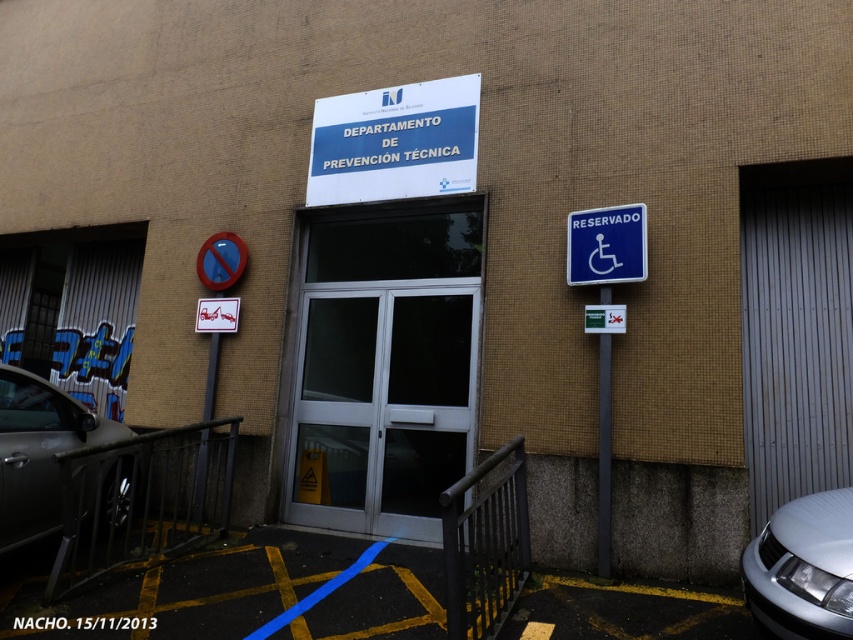
Consider the image. You are a delivery person trying to park your silver metallic car at lower right near the entrance. The white glass door at center is in the way. Can you drive your car past the door without hitting it?

The white glass door at center has a greater height compared to the silver metallic car at lower right. Since the door is taller, it won

You are a visitor arriving at the Department of Technical Prevention building. You see a silver metallic car at lower right and a shiny black car at lower left. Which car is closer to the ground?

The silver metallic car at lower right has a lesser height compared to the shiny black car at lower left, so it is closer to the ground.

You are standing at the entrance of the DEPARTAMENTO DE PREVENCION TECNICA building and want to take a photo of the two points labeled point [329,504] and point [842,612]. Which point will appear closer to the top of the photo?

Point [842,612] will appear closer to the top of the photo because it has a higher y coordinate value than point [329,504].